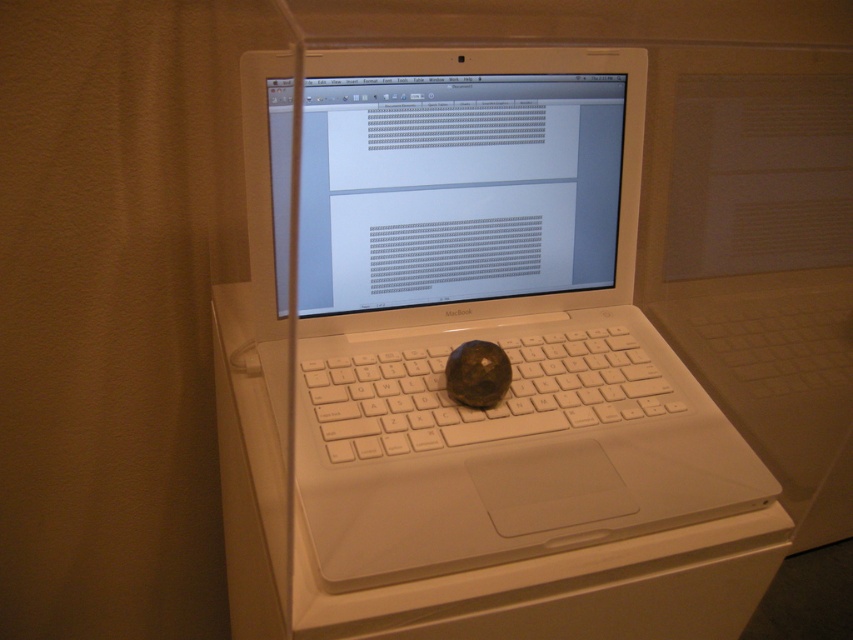
You are a photographer taking a closeup shot of the white plastic laptop at center. To ensure the keyboard is in focus, should you move the camera closer or farther away from the white plastic keyboard at center?

The white plastic laptop at center is closer to the viewer than the white plastic keyboard at center. To focus on the keyboard, you need to adjust the camera to focus on the white plastic keyboard at center, which is farther away than the white plastic laptop at center.

Based on the photo, you are setting up a new workspace and need to place a mouse next to the white plastic keyboard at center. Considering the white plastic laptop at center is much taller than the keyboard, where should you position the mouse to ensure it doesn

The white plastic laptop at center is much taller than the white plastic keyboard at center, so positioning the mouse to the side of the keyboard would provide enough space to use it comfortably without obstruction from the laptop.